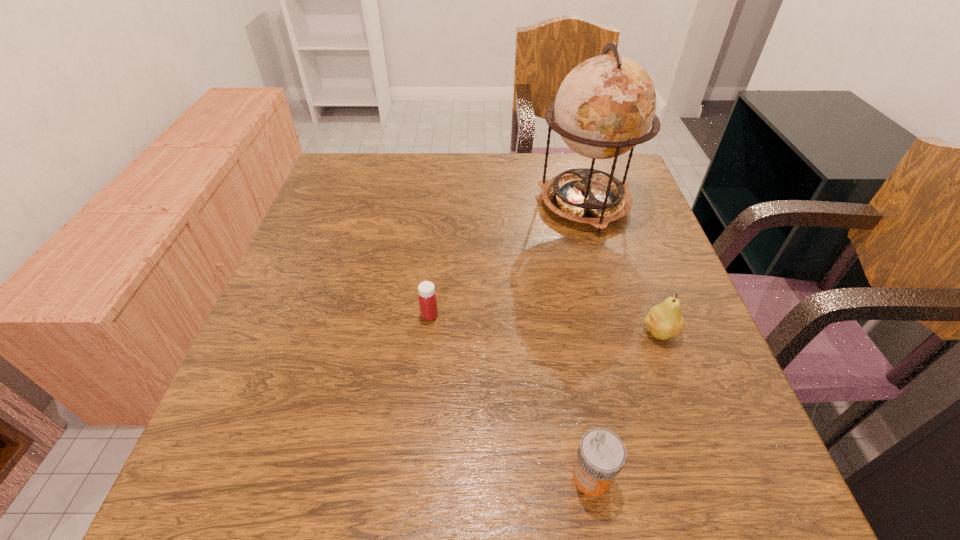
The image size is (960, 540). Identify the location of free space at the left edge of the desktop. (283, 361).

You are a GUI agent. You are given a task and a screenshot of the screen. Output one action in this format:
    pyautogui.click(x=<x>, y=<y>)
    Task: Click on the free space at the right edge
    
    Given the screenshot: What is the action you would take?
    pyautogui.click(x=660, y=280)

This screenshot has width=960, height=540. Find the location of `vacant region at the far left corner`. vacant region at the far left corner is located at coordinates (341, 172).

In the image, there is a desktop. At what (x,y) coordinates should I click in order to perform the action: click on free region at the far right corner. Please return your answer as a coordinate pair (x, y). The height and width of the screenshot is (540, 960). Looking at the image, I should click on (580, 164).

Find the location of a particular element. The width and height of the screenshot is (960, 540). free space at the near right corner of the desktop is located at coordinates (785, 508).

Identify the location of unoccupied position between the tallest object and the nearer medicine. (588, 341).

The image size is (960, 540). I want to click on unoccupied position between the farthest object and the leftmost object, so click(x=507, y=260).

You are a GUI agent. You are given a task and a screenshot of the screen. Output one action in this format:
    pyautogui.click(x=<x>, y=<y>)
    Task: Click on the free spot between the farther medicine and the nearer medicine
    This screenshot has width=960, height=540.
    Given the screenshot: What is the action you would take?
    pyautogui.click(x=511, y=396)

Identify the location of free spot between the pear and the globe. (622, 269).

Where is `free space between the tallest object and the pear`? This screenshot has height=540, width=960. free space between the tallest object and the pear is located at coordinates (622, 269).